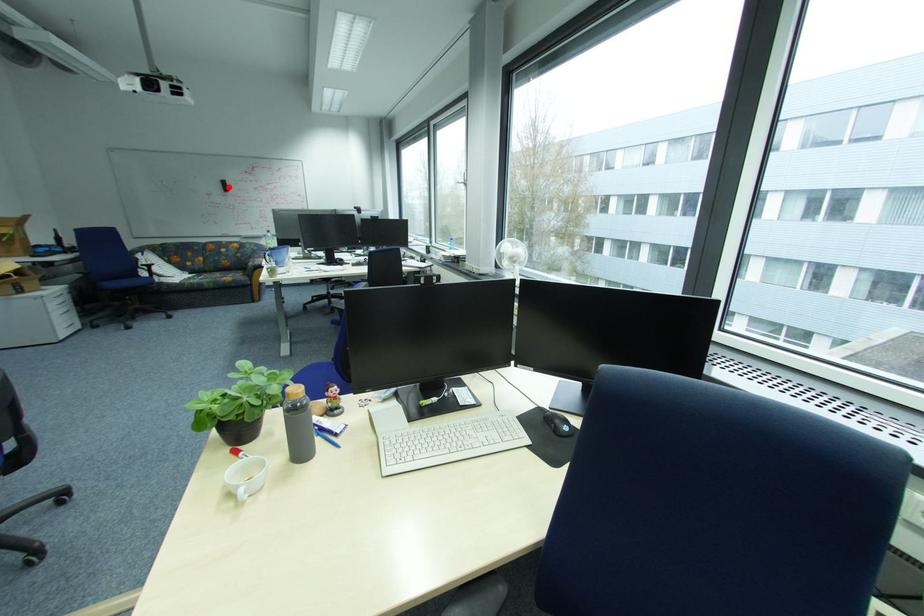
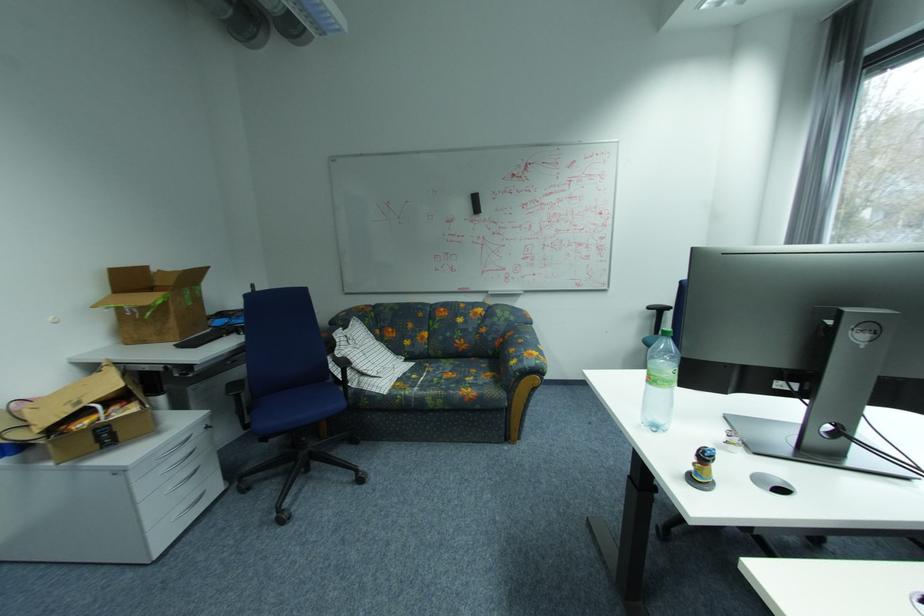
In the second image, find the point that corresponds to the highlighted location in the first image.

(476, 206)